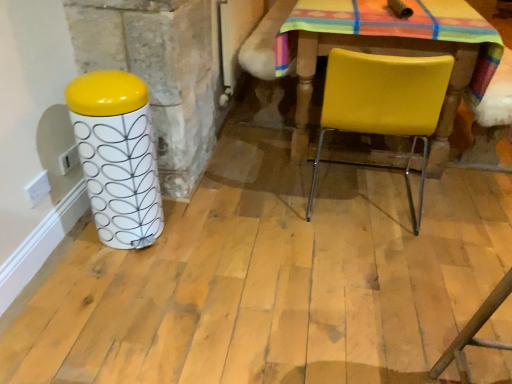
Image resolution: width=512 pixels, height=384 pixels. What are the coordinates of `unoccupied region to the right of white glossy patterned canister at left` in the screenshot? It's located at (188, 232).